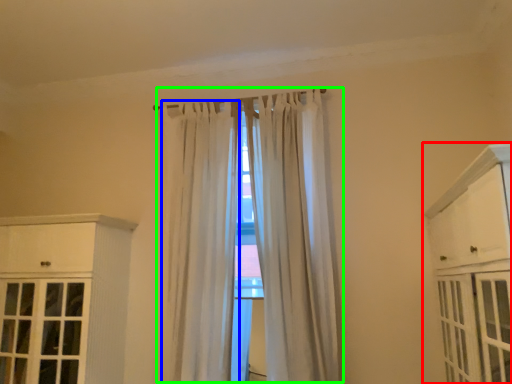
Question: Based on their relative distances, which object is nearer to cabinetry (highlighted by a red box)? Choose from curtain (highlighted by a blue box) and curtain (highlighted by a green box).

Choices:
 (A) curtain
 (B) curtain

Answer: (B)